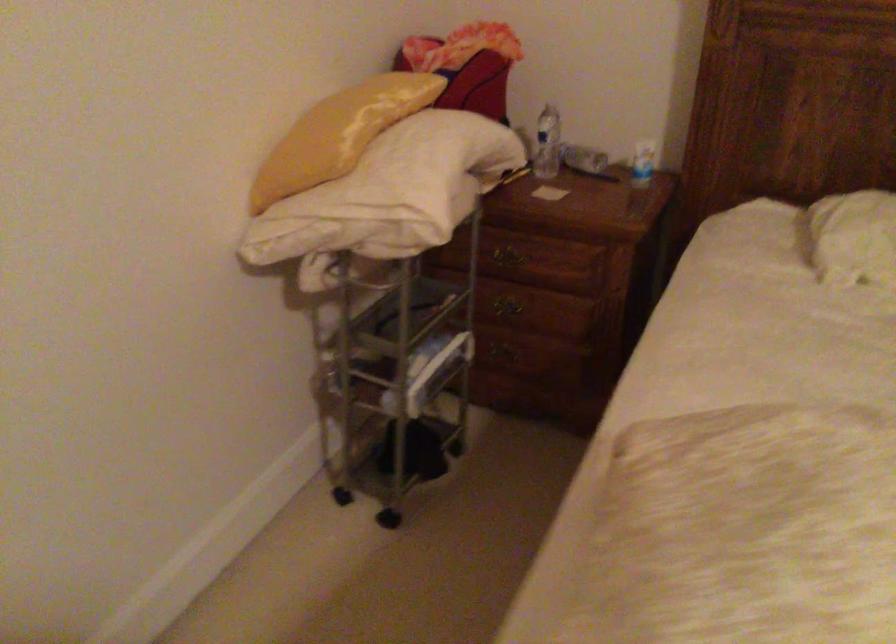
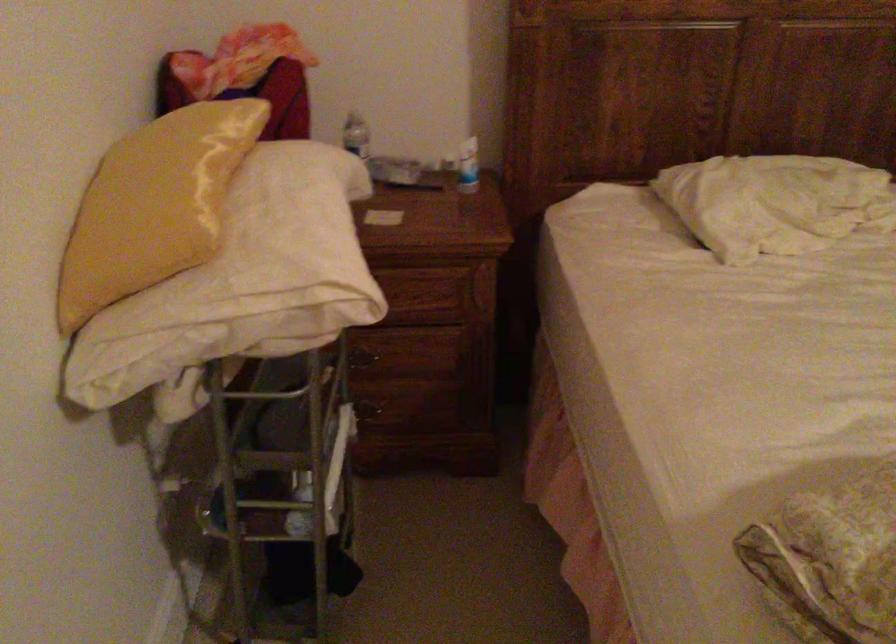
Locate, in the second image, the point that corresponds to point (364, 192) in the first image.

(254, 272)